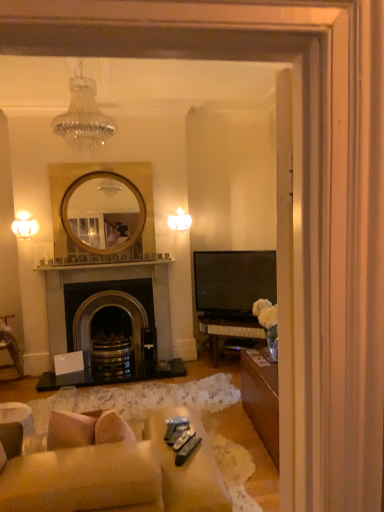
Question: Are metallic gray remote control at lower center, the 3th remote control from the back, and dark gray stone fireplace at center far apart?

Choices:
 (A) no
 (B) yes

Answer: (B)

Question: Is metallic gray remote control at lower center, the 1th remote control viewed from the front, outside of dark gray stone fireplace at center?

Choices:
 (A) yes
 (B) no

Answer: (A)

Question: Is the position of metallic gray remote control at lower center, the 1th remote control viewed from the front, more distant than that of dark gray stone fireplace at center?

Choices:
 (A) no
 (B) yes

Answer: (A)

Question: Does metallic gray remote control at lower center, the 1th remote control viewed from the front, appear on the right side of dark gray stone fireplace at center?

Choices:
 (A) no
 (B) yes

Answer: (B)

Question: From the image's perspective, would you say metallic gray remote control at lower center, the 3th remote control from the back, is shown under dark gray stone fireplace at center?

Choices:
 (A) yes
 (B) no

Answer: (A)

Question: From a real-world perspective, is metallic gray remote control at lower center, the 1th remote control viewed from the front, located beneath dark gray stone fireplace at center?

Choices:
 (A) yes
 (B) no

Answer: (A)

Question: Is metallic gray remote control at lower center, the 1th remote control viewed from the front, bigger than matte white lampshade at upper center, which is the second lamp in top-to-bottom order?

Choices:
 (A) no
 (B) yes

Answer: (A)

Question: From the image's perspective, is metallic gray remote control at lower center, the 1th remote control viewed from the front, on top of matte white lampshade at upper center, which appears as the 2th lamp when ordered from the bottom?

Choices:
 (A) yes
 (B) no

Answer: (B)

Question: Is metallic gray remote control at lower center, the 3th remote control from the back, located outside matte white lampshade at upper center, the first lamp viewed from the back?

Choices:
 (A) no
 (B) yes

Answer: (B)

Question: Could you tell me if metallic gray remote control at lower center, the 1th remote control viewed from the front, is facing matte white lampshade at upper center, which appears as the 2th lamp when ordered from the bottom?

Choices:
 (A) no
 (B) yes

Answer: (A)

Question: Can you confirm if metallic gray remote control at lower center, the 3th remote control from the back, is shorter than matte white lampshade at upper center, the 3th lamp when ordered from front to back?

Choices:
 (A) no
 (B) yes

Answer: (B)

Question: From a real-world perspective, is metallic gray remote control at lower center, the 1th remote control viewed from the front, positioned over matte white lampshade at upper center, the first lamp viewed from the back, based on gravity?

Choices:
 (A) no
 (B) yes

Answer: (A)

Question: Does matte white sconce at left, marked as the 1th lamp in a bottom-to-top arrangement, have a smaller size compared to black plastic remote control at lower center, which is counted as the first remote control, starting from the back?

Choices:
 (A) yes
 (B) no

Answer: (B)